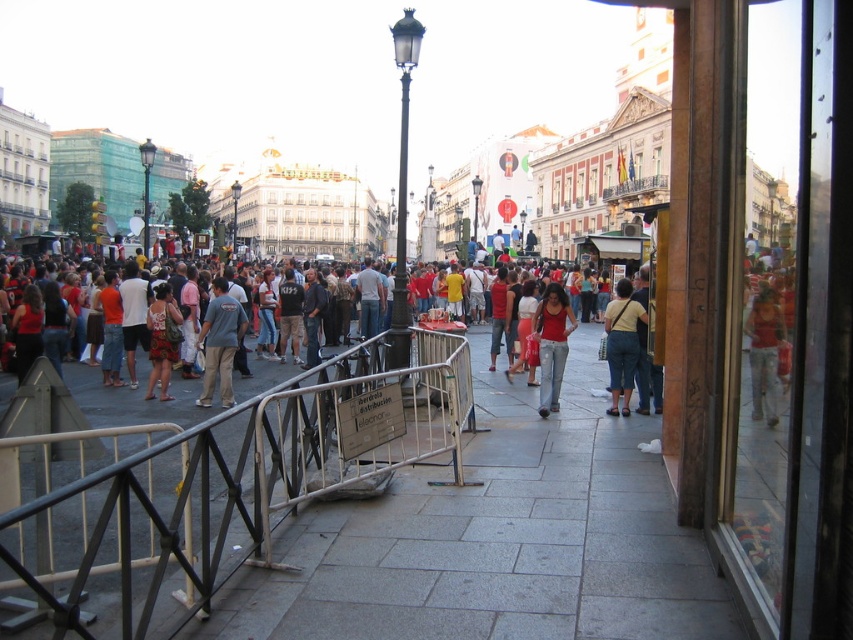
How distant is denim jeans at right from blue cotton shirt at center?

38.17 meters

Is denim jeans at right taller than blue cotton shirt at center?

No, denim jeans at right is not taller than blue cotton shirt at center.

Identify the location of denim jeans at right. (764, 353).

At what (x,y) coordinates should I click in order to perform the action: click on denim jeans at right. Please return your answer as a coordinate pair (x, y). Image resolution: width=853 pixels, height=640 pixels. Looking at the image, I should click on (764, 353).

Is point (767, 289) farther from viewer compared to point (540, 356)?

That is False.

Does denim jeans at right have a lesser height compared to matte red shirt at center?

Yes.

Image resolution: width=853 pixels, height=640 pixels. What do you see at coordinates (764, 353) in the screenshot?
I see `denim jeans at right` at bounding box center [764, 353].

Locate an element on the screen. This screenshot has width=853, height=640. denim jeans at right is located at coordinates (764, 353).

Is denim jeans at right thinner than matte red dress at center?

Indeed, denim jeans at right has a lesser width compared to matte red dress at center.

Is point (753, 396) in front of point (155, 321)?

Yes, it is in front of point (155, 321).

Between point (763, 403) and point (173, 316), which one is positioned behind?

Point (173, 316)

Locate an element on the screen. denim jeans at right is located at coordinates (764, 353).